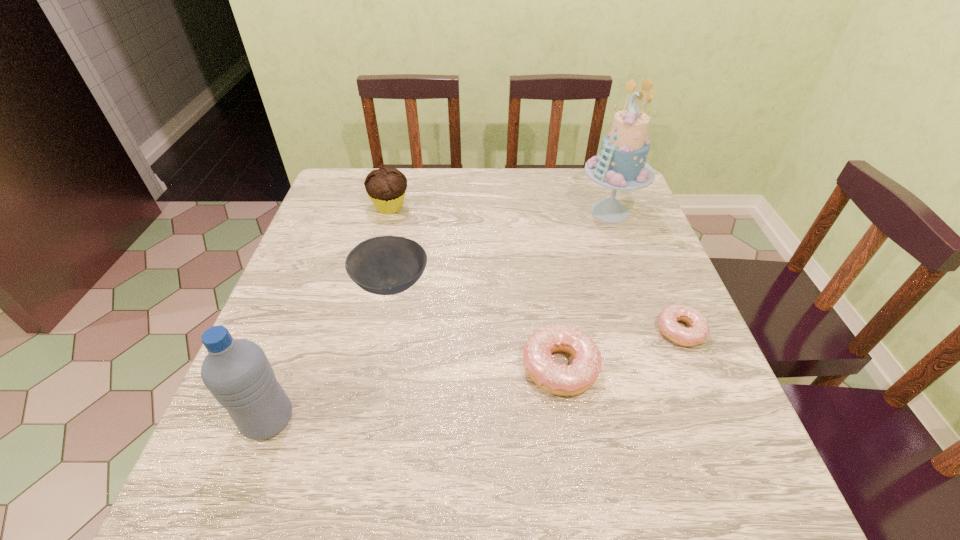
Identify the location of free region at the near edge of the desktop. The width and height of the screenshot is (960, 540). (480, 410).

At what (x,y) coordinates should I click in order to perform the action: click on free location at the left edge. Please return your answer as a coordinate pair (x, y). This screenshot has width=960, height=540. Looking at the image, I should click on (316, 253).

In order to click on vacant space at the right edge in this screenshot , I will do `click(634, 238)`.

Identify the location of free space between the third shortest object and the tallest object. (500, 248).

Where is `unoccupied position between the cake and the right doughnut`? The width and height of the screenshot is (960, 540). unoccupied position between the cake and the right doughnut is located at coordinates (645, 271).

Locate an element on the screen. The image size is (960, 540). unoccupied area between the water bottle and the third object from right to left is located at coordinates (414, 394).

Where is `vacant area that lies between the tallest object and the third object from right to left`? The height and width of the screenshot is (540, 960). vacant area that lies between the tallest object and the third object from right to left is located at coordinates 585,289.

Find the location of a particular element. The height and width of the screenshot is (540, 960). vacant area that lies between the water bottle and the muffin is located at coordinates (329, 313).

Locate an element on the screen. The width and height of the screenshot is (960, 540). vacant region between the fourth tallest object and the water bottle is located at coordinates (329, 352).

This screenshot has width=960, height=540. In order to click on free space between the taller doughnut and the leftmost object in this screenshot , I will do `click(414, 394)`.